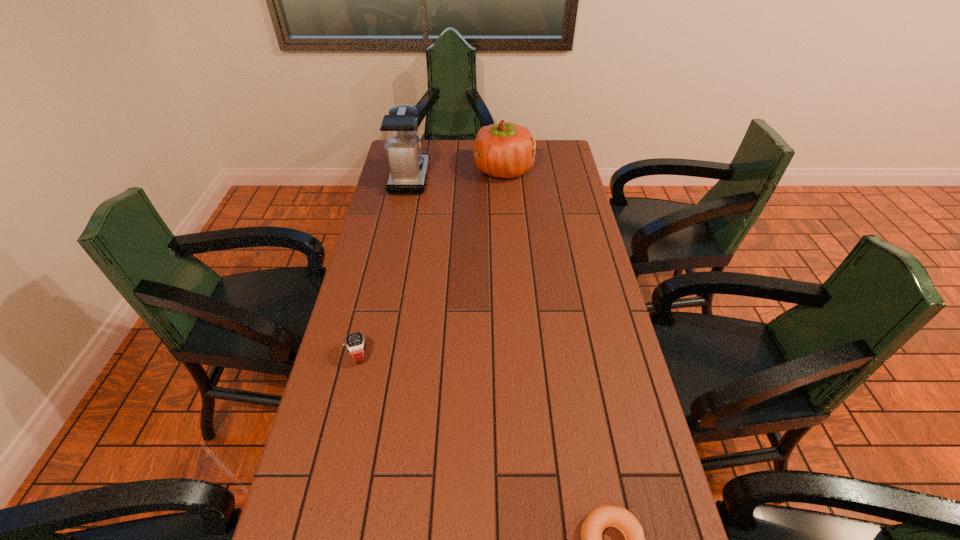
Identify the location of coffee maker. (399, 130).

Find the location of a particular element. pumpkin is located at coordinates (506, 150).

At what (x,y) coordinates should I click in order to perform the action: click on the second shortest object. Please return your answer as a coordinate pair (x, y). Looking at the image, I should click on (355, 343).

Find the location of a particular element. The width and height of the screenshot is (960, 540). watch is located at coordinates (355, 343).

In order to click on free region located 0.050m at the front of the coffee maker where the controls are located in this screenshot , I will do `click(441, 178)`.

What are the coordinates of `free region located on the side of the second tallest object with the cute face` in the screenshot? It's located at tap(436, 171).

You are a GUI agent. You are given a task and a screenshot of the screen. Output one action in this format:
    pyautogui.click(x=<x>, y=<y>)
    Task: Click on the blank area located on the side of the second tallest object with the cute face
    
    Given the screenshot: What is the action you would take?
    pyautogui.click(x=460, y=171)

This screenshot has height=540, width=960. Find the location of `vacant area situated 0.060m on the side of the second tallest object with the cute face`. vacant area situated 0.060m on the side of the second tallest object with the cute face is located at coordinates (460, 171).

This screenshot has height=540, width=960. I want to click on vacant space situated on the front of the watch, so click(x=336, y=448).

The height and width of the screenshot is (540, 960). I want to click on coffee maker positioned at the far edge, so click(399, 130).